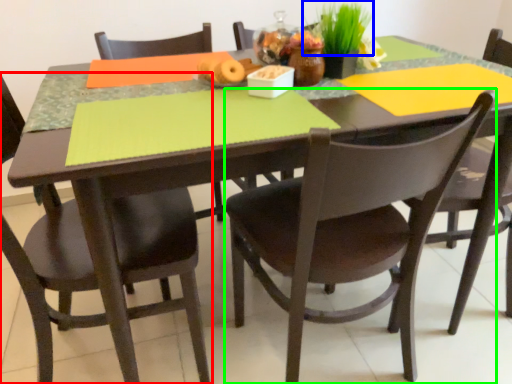
Question: Considering the real-world distances, which object is closest to chair (highlighted by a red box)? plant (highlighted by a blue box) or chair (highlighted by a green box).

Choices:
 (A) plant
 (B) chair

Answer: (B)